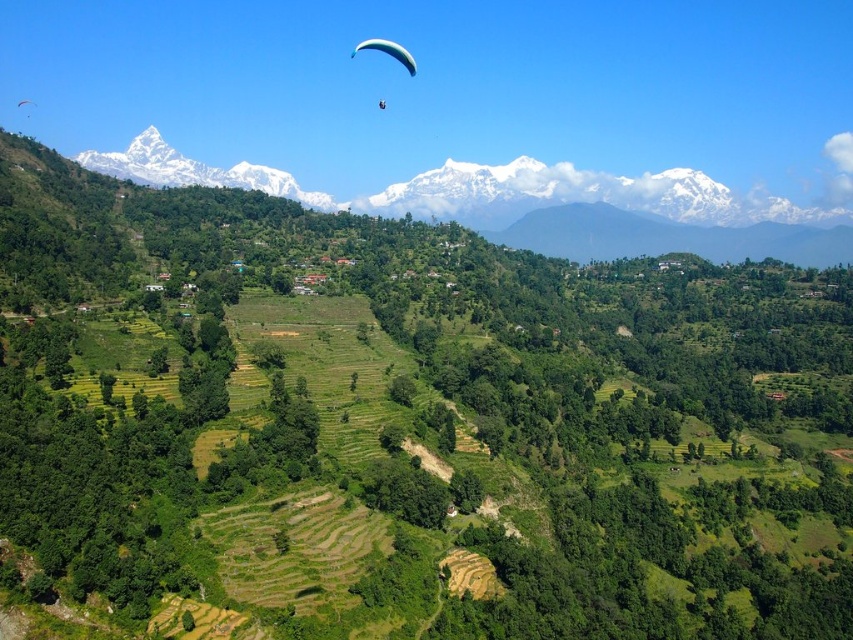
Question: Which point appears closest to the camera in this image?

Choices:
 (A) (123, 154)
 (B) (360, 49)

Answer: (B)

Question: Can you confirm if white snow-covered mountain at upper left is positioned above blue fabric parachute at upper center?

Choices:
 (A) no
 (B) yes

Answer: (A)

Question: Which point appears farthest from the camera in this image?

Choices:
 (A) (415, 65)
 (B) (216, 179)

Answer: (B)

Question: Is the position of white snow-covered mountain at upper left less distant than that of blue fabric parachute at upper center?

Choices:
 (A) yes
 (B) no

Answer: (B)

Question: Can you confirm if white snow-covered mountain at upper left is positioned to the left of blue fabric parachute at upper center?

Choices:
 (A) no
 (B) yes

Answer: (B)